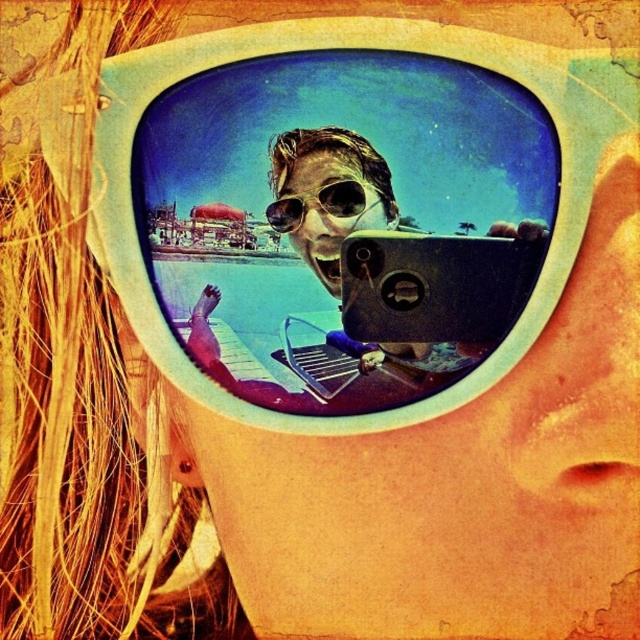
What do you see at coordinates (326, 208) in the screenshot?
I see `matte plastic face at center` at bounding box center [326, 208].

Consider the image. Between matte plastic face at center and matte white sunglasses at center, which one is positioned lower?

matte plastic face at center is lower down.

The height and width of the screenshot is (640, 640). What do you see at coordinates (326, 208) in the screenshot? I see `matte plastic face at center` at bounding box center [326, 208].

Where is `matte plastic face at center`? This screenshot has height=640, width=640. matte plastic face at center is located at coordinates (326, 208).